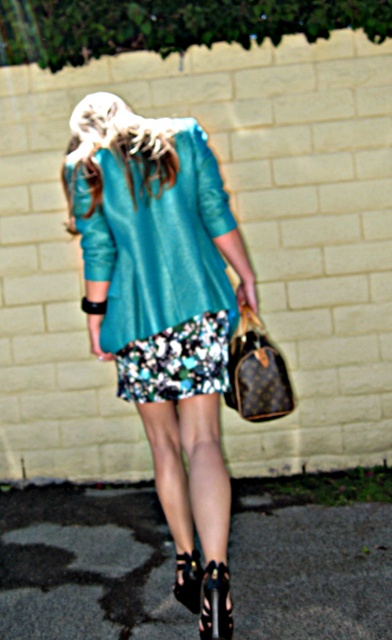
Is point (217, 374) in front of point (217, 275)?

No, (217, 374) is further to viewer.

Between point (156, 426) and point (214, 292), which one is positioned behind?

Point (156, 426)

Who is more distant from viewer, (x=170, y=141) or (x=117, y=248)?

Positioned behind is point (x=117, y=248).

Where is `teal leather jacket at center`? Image resolution: width=392 pixels, height=640 pixels. teal leather jacket at center is located at coordinates (161, 292).

Can you confirm if black asphalt pavement at lower center is positioned below floral printed skirt at center?

Indeed, black asphalt pavement at lower center is positioned under floral printed skirt at center.

From the picture: Does black asphalt pavement at lower center come behind floral printed skirt at center?

No, it is not.

Locate an element on the screen. This screenshot has height=640, width=392. black asphalt pavement at lower center is located at coordinates (87, 566).

Which of these two, black asphalt pavement at lower center or brown leather handbag at lower center, stands taller?

brown leather handbag at lower center is taller.

Which is below, black asphalt pavement at lower center or brown leather handbag at lower center?

black asphalt pavement at lower center is lower down.

Between point (248, 568) and point (245, 312), which one is positioned in front?

Positioned in front is point (245, 312).

Locate an element on the screen. black asphalt pavement at lower center is located at coordinates (87, 566).